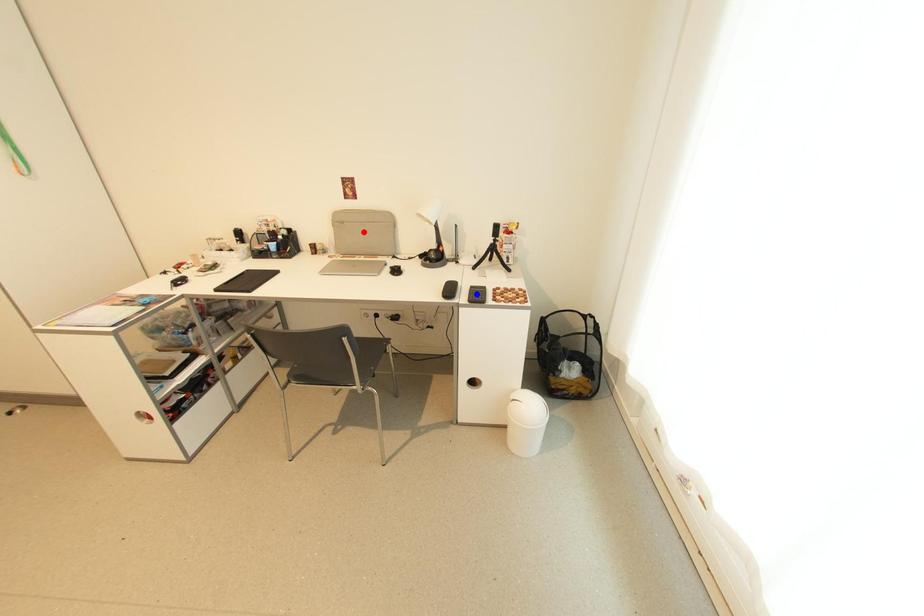
Question: Which of the two points in the image is closer to the camera?

Choices:
 (A) Blue point is closer.
 (B) Red point is closer.

Answer: (A)